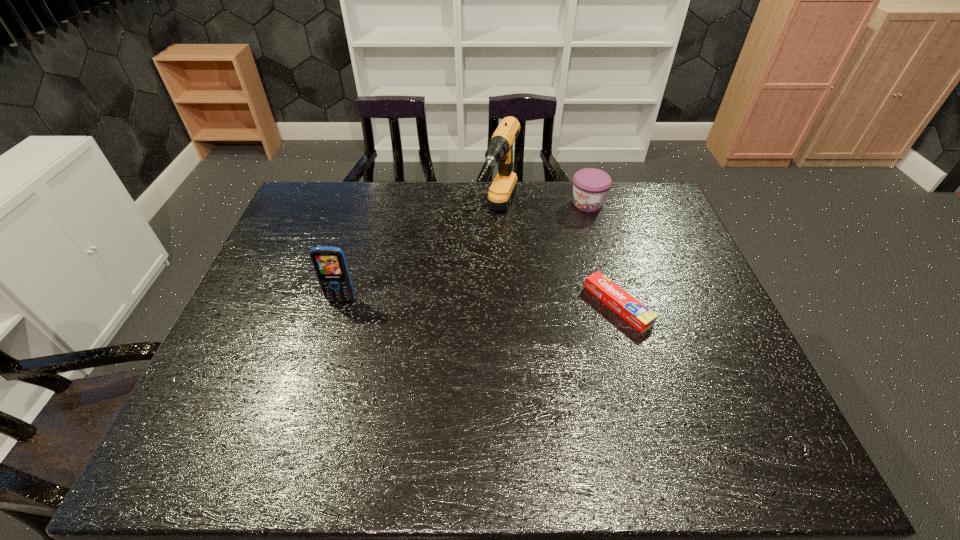
You are a GUI agent. You are given a task and a screenshot of the screen. Output one action in this format:
    pyautogui.click(x=<x>, y=<y>)
    Task: Click on the vacant area situated 0.050m at the tip of the tallest object
    The height and width of the screenshot is (540, 960).
    Given the screenshot: What is the action you would take?
    tap(490, 255)

Where is `vacant area located 0.250m on the front label of the jam`? The width and height of the screenshot is (960, 540). vacant area located 0.250m on the front label of the jam is located at coordinates (537, 250).

Locate an element on the screen. The image size is (960, 540). vacant position located on the front label of the jam is located at coordinates (519, 266).

Find the location of `free point located on the front label of the jam`. free point located on the front label of the jam is located at coordinates (537, 250).

Where is `drill located at the far edge`? This screenshot has width=960, height=540. drill located at the far edge is located at coordinates (500, 149).

The image size is (960, 540). What are the coordinates of `jam that is positioned at the far edge` in the screenshot? It's located at (590, 186).

This screenshot has height=540, width=960. Identify the location of vacant space at the far edge of the desktop. (408, 201).

Locate an element on the screen. free space at the left edge is located at coordinates (249, 301).

The width and height of the screenshot is (960, 540). In the image, there is a desktop. Identify the location of vacant space at the right edge. (684, 300).

This screenshot has width=960, height=540. In the image, there is a desktop. Identify the location of vacant space at the far left corner. (334, 218).